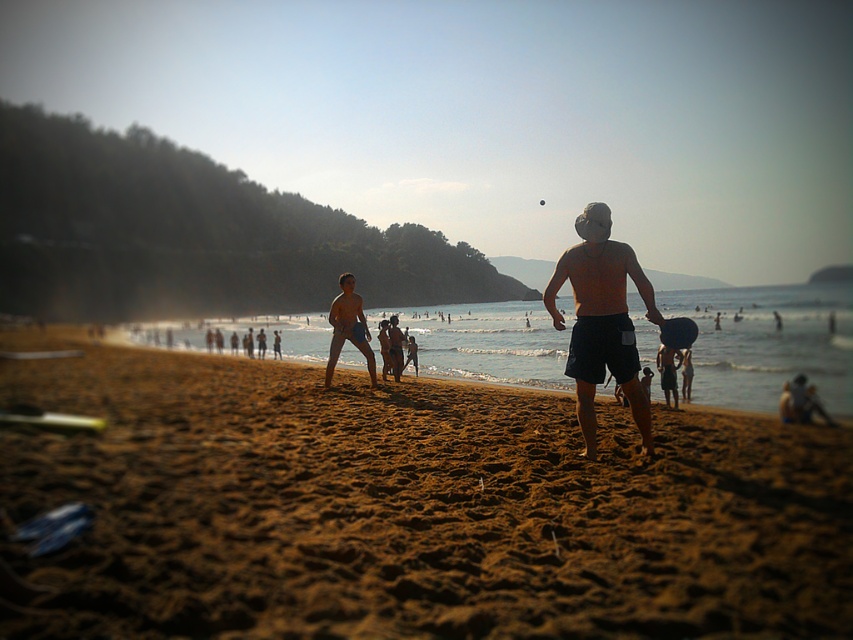
Does brown sandy beach at center appear on the right side of smooth tan shorts at center?

Incorrect, brown sandy beach at center is not on the right side of smooth tan shorts at center.

Is point (547, 586) less distant than point (349, 276)?

Yes, point (547, 586) is in front of point (349, 276).

Which is in front, point (26, 573) or point (349, 284)?

Point (26, 573) is more forward.

I want to click on brown sandy beach at center, so click(407, 508).

Can you confirm if brown sandy beach at center is wider than orange matte shorts at center?

Correct, the width of brown sandy beach at center exceeds that of orange matte shorts at center.

Who is lower down, brown sandy beach at center or orange matte shorts at center?

Positioned lower is brown sandy beach at center.

Who is more distant from viewer, (x=637, y=588) or (x=566, y=268)?

Positioned behind is point (x=566, y=268).

The image size is (853, 640). In order to click on brown sandy beach at center in this screenshot , I will do `click(407, 508)`.

Between point (633, 353) and point (357, 308), which one is positioned behind?

The point (357, 308) is more distant.

Which is in front, point (612, 275) or point (329, 369)?

Point (612, 275)

At what (x,y) coordinates should I click in order to perform the action: click on orange matte shorts at center. Please return your answer as a coordinate pair (x, y). Looking at the image, I should click on (601, 320).